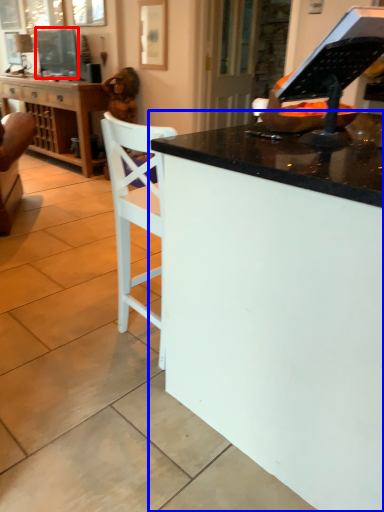
Question: Which of the following is the closest to the observer, television (highlighted by a red box) or desk (highlighted by a blue box)?

Choices:
 (A) television
 (B) desk

Answer: (B)